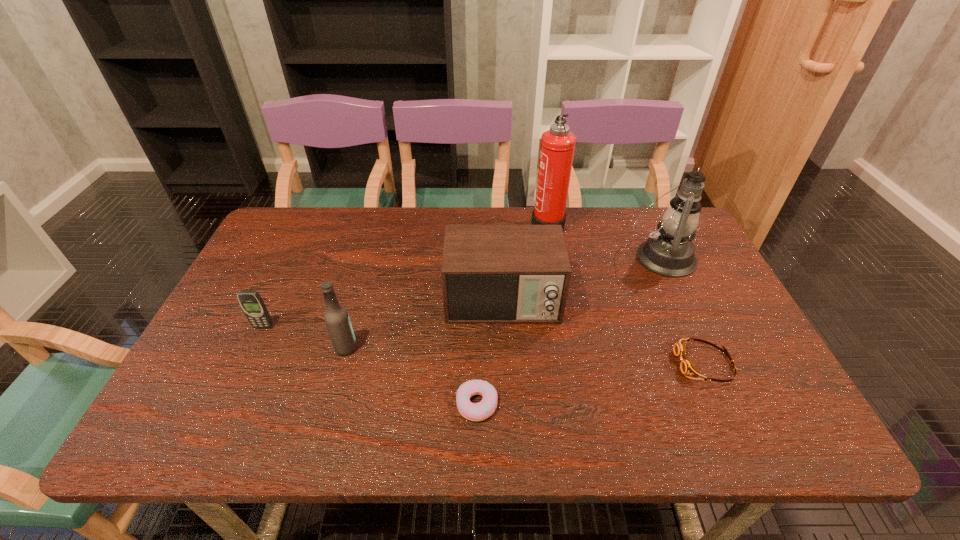
You are a GUI agent. You are given a task and a screenshot of the screen. Output one action in this format:
    pyautogui.click(x=<x>, y=<y>)
    Task: Click on the vacant space that is in between the fire extinguisher and the goggles
    The height and width of the screenshot is (540, 960).
    Given the screenshot: What is the action you would take?
    [x=626, y=294]

This screenshot has width=960, height=540. Find the location of `free space between the fourth shortest object and the second object from left to right`. free space between the fourth shortest object and the second object from left to right is located at coordinates (424, 325).

Find the location of a particular element. The height and width of the screenshot is (540, 960). object that ranks as the second closest to the sixth object from right to left is located at coordinates (490, 273).

Locate an element on the screen. object that ranks as the closest to the fire extinguisher is located at coordinates (490, 273).

Image resolution: width=960 pixels, height=540 pixels. I want to click on vacant space that satisfies the following two spatial constraints: 1. on the front-facing side of the fourth tallest object; 2. on the side of the fifth shortest object with the label, so click(x=505, y=348).

You are a GUI agent. You are given a task and a screenshot of the screen. Output one action in this format:
    pyautogui.click(x=<x>, y=<y>)
    Task: Click on the free space that satisfies the following two spatial constraints: 1. on the front-facing side of the sixth shortest object; 2. on the left side of the fire extinguisher
    This screenshot has width=960, height=540.
    Given the screenshot: What is the action you would take?
    pyautogui.click(x=553, y=257)

Identify the location of blank space that satisfies the following two spatial constraints: 1. on the front-facing side of the tallest object; 2. on the front-facing side of the radio receiver. The image size is (960, 540). (562, 301).

The height and width of the screenshot is (540, 960). What are the coordinates of `vacant space that satisfies the following two spatial constraints: 1. on the front-facing side of the tallest object; 2. on the front-facing side of the fourth shortest object` in the screenshot? It's located at (562, 301).